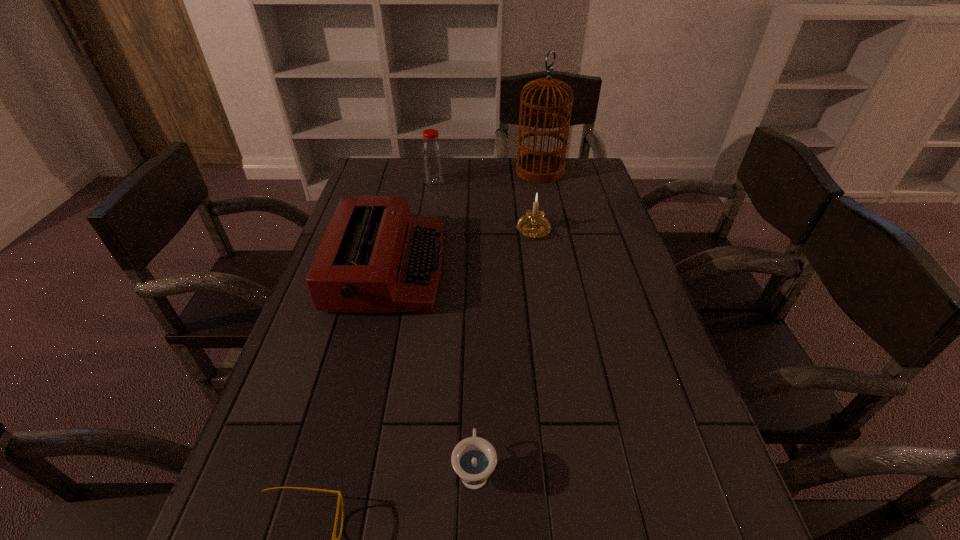
Image resolution: width=960 pixels, height=540 pixels. Identify the location of vacant space at the right edge of the desktop. (594, 232).

What are the coordinates of `vacant space at the far right corner of the desktop` in the screenshot? It's located at (588, 190).

This screenshot has height=540, width=960. In order to click on vacant area between the typewriter and the tallest object in this screenshot , I will do `click(464, 220)`.

Where is `vacant space in between the third object from right to left and the candle holder`? vacant space in between the third object from right to left and the candle holder is located at coordinates (504, 350).

Where is `free point between the teacup and the tallest object`? This screenshot has width=960, height=540. free point between the teacup and the tallest object is located at coordinates (507, 320).

You are a GUI agent. You are given a task and a screenshot of the screen. Output one action in this format:
    pyautogui.click(x=<x>, y=<y>)
    Task: Click on the vacant space in between the typewriter and the birdcage
    This screenshot has height=540, width=960.
    Given the screenshot: What is the action you would take?
    [x=464, y=220]

You are a GUI agent. You are given a task and a screenshot of the screen. Output one action in this format:
    pyautogui.click(x=<x>, y=<y>)
    Task: Click on the vacant space in between the tallest object and the second shortest object
    The height and width of the screenshot is (540, 960).
    Given the screenshot: What is the action you would take?
    tap(507, 320)

Where is `free space between the candle holder and the typewriter`? The image size is (960, 540). free space between the candle holder and the typewriter is located at coordinates (461, 249).

Identify which object is the second closest to the shortest object. Please provide its 2D coordinates. Your answer should be formatted as a tuple, i.e. [(x, y)], where the tuple contains the x and y coordinates of a point satisfying the conditions above.

[(376, 256)]

Identify which object is located as the fifth nearest to the candle holder. Please provide its 2D coordinates. Your answer should be formatted as a tuple, i.e. [(x, y)], where the tuple contains the x and y coordinates of a point satisfying the conditions above.

[(334, 539)]